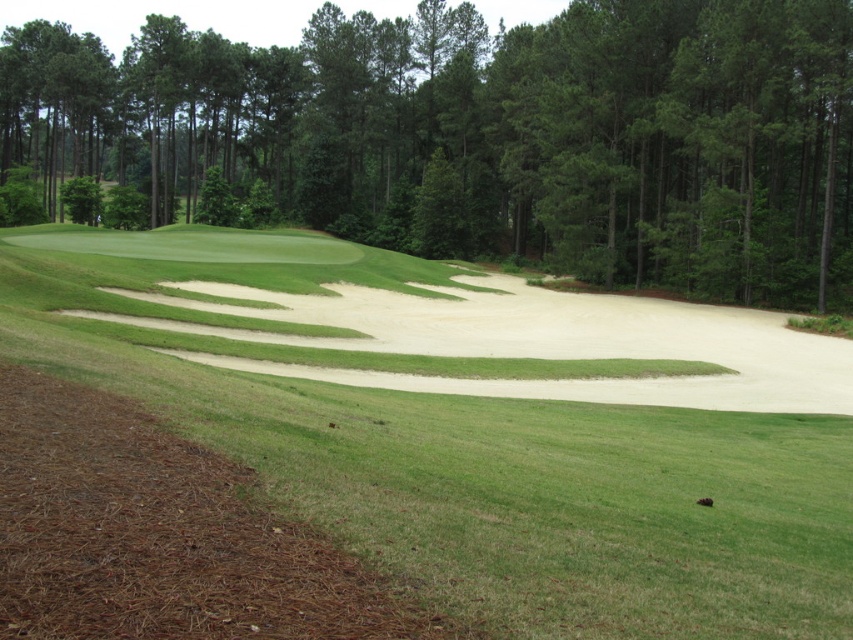
The height and width of the screenshot is (640, 853). What do you see at coordinates (468, 454) in the screenshot? I see `sandy beige sand trap at center` at bounding box center [468, 454].

Is sandy beige sand trap at center bigger than green leafy tree at center?

Actually, sandy beige sand trap at center might be smaller than green leafy tree at center.

The height and width of the screenshot is (640, 853). I want to click on sandy beige sand trap at center, so click(x=468, y=454).